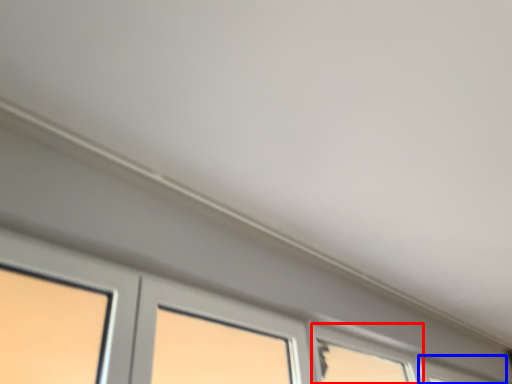
Question: Which point is further to the camera, window (highlighted by a red box) or window (highlighted by a blue box)?

Choices:
 (A) window
 (B) window

Answer: (B)